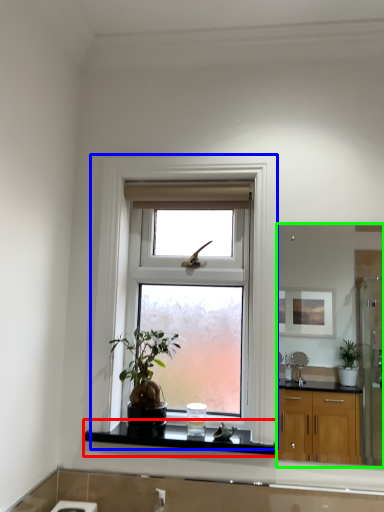
Question: Which object is positioned farthest from window sill (highlighted by a red box)? Select from window (highlighted by a blue box) and mirror (highlighted by a green box).

Choices:
 (A) window
 (B) mirror

Answer: (B)